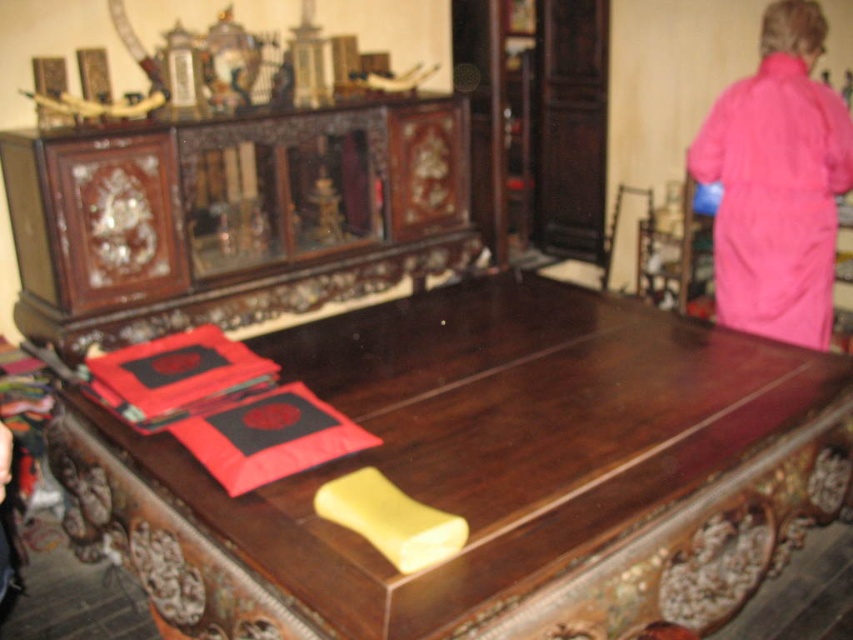
Between dark brown polished wood cabinet at center and pink fabric robe at upper right, which one has more height?

dark brown polished wood cabinet at center is taller.

Between dark brown polished wood cabinet at center and pink fabric robe at upper right, which one has less height?

pink fabric robe at upper right

Locate an element on the screen. This screenshot has width=853, height=640. dark brown polished wood cabinet at center is located at coordinates (231, 218).

You are a GUI agent. You are given a task and a screenshot of the screen. Output one action in this format:
    pyautogui.click(x=<x>, y=<y>)
    Task: Click on the dark brown polished wood cabinet at center
    The height and width of the screenshot is (640, 853).
    Given the screenshot: What is the action you would take?
    pyautogui.click(x=231, y=218)

Between polished wood table at center and pink fabric robe at upper right, which one appears on the left side from the viewer's perspective?

polished wood table at center is more to the left.

Does polished wood table at center have a greater height compared to pink fabric robe at upper right?

No.

Does point (744, 394) lie in front of point (785, 230)?

That is True.

The image size is (853, 640). What are the coordinates of `polished wood table at center` in the screenshot? It's located at [490, 474].

Which is in front, point (302, 493) or point (90, 324)?

Point (302, 493)

Who is positioned more to the left, polished wood table at center or dark brown polished wood cabinet at center?

dark brown polished wood cabinet at center is more to the left.

Does point (321, 372) lie in front of point (12, 161)?

Yes, point (321, 372) is closer to viewer.

The image size is (853, 640). In order to click on polished wood table at center in this screenshot , I will do `click(490, 474)`.